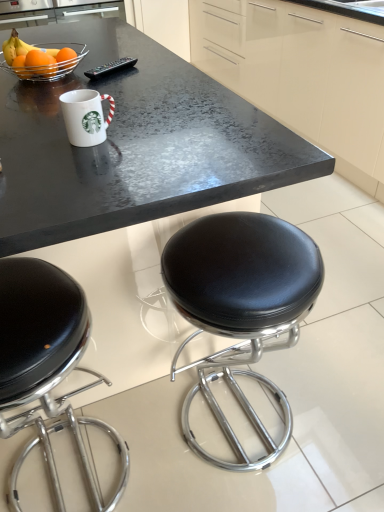
This screenshot has height=512, width=384. What are the coordinates of `free space between white glossy mug at upper center and black plastic remote control at upper center` in the screenshot? It's located at (125, 90).